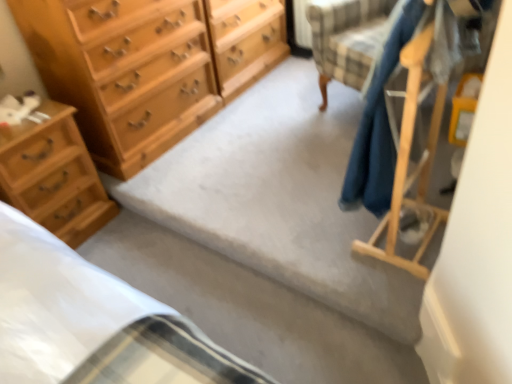
Where is `vacant space that is to the left of wooden coat rack at right`? The width and height of the screenshot is (512, 384). vacant space that is to the left of wooden coat rack at right is located at coordinates (302, 231).